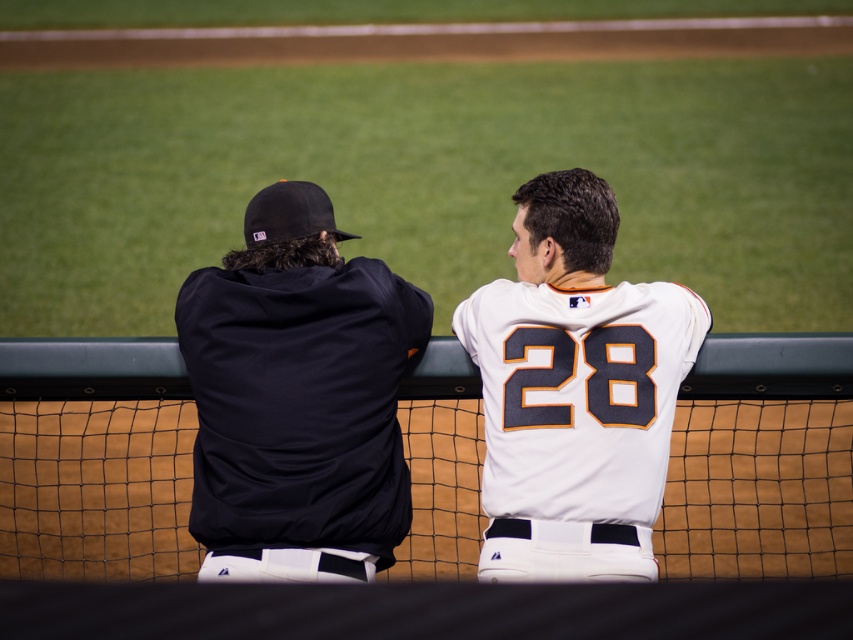
Is point (303, 378) behind point (628, 285)?

No.

The width and height of the screenshot is (853, 640). What do you see at coordinates (299, 397) in the screenshot? I see `dark blue jersey at left` at bounding box center [299, 397].

What are the coordinates of `dark blue jersey at left` in the screenshot? It's located at (299, 397).